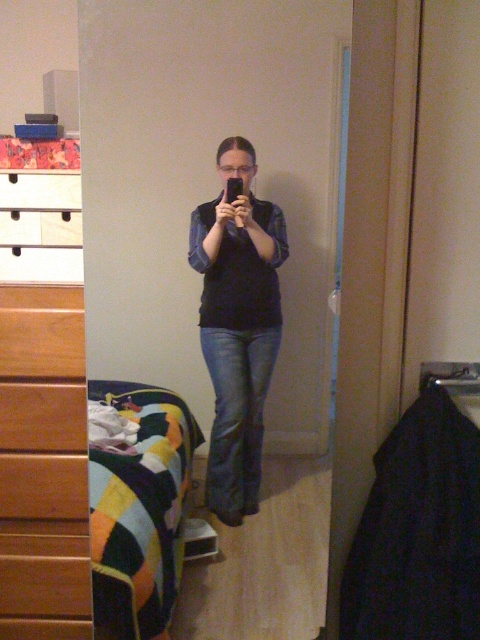
You are a photographer trying to capture the wooden dresser at left and the multicolored fabric bed at lower left in a single frame. Based on their positions, which object should you focus on first to ensure both are in the frame?

The wooden dresser at left is positioned over the multicolored fabric bed at lower left, so you should focus on the wooden dresser at left first to ensure both are in the frame.

You are standing in the bedroom scene. There is a point marked at coordinates (140, 509). What object is located at this point?

The point at coordinates (140, 509) marks the multicolored fabric bed at lower left.

You are trying to take a mirror selfie in the bedroom shown. You need to position yourself between the wooden dresser at left and the multicolored fabric bed at lower left. Which object should you stand closer to if you want to be equidistant from both?

Since the wooden dresser at left is to the left of the multicolored fabric bed at lower left, you should stand closer to the wooden dresser at left to be equidistant from both objects.